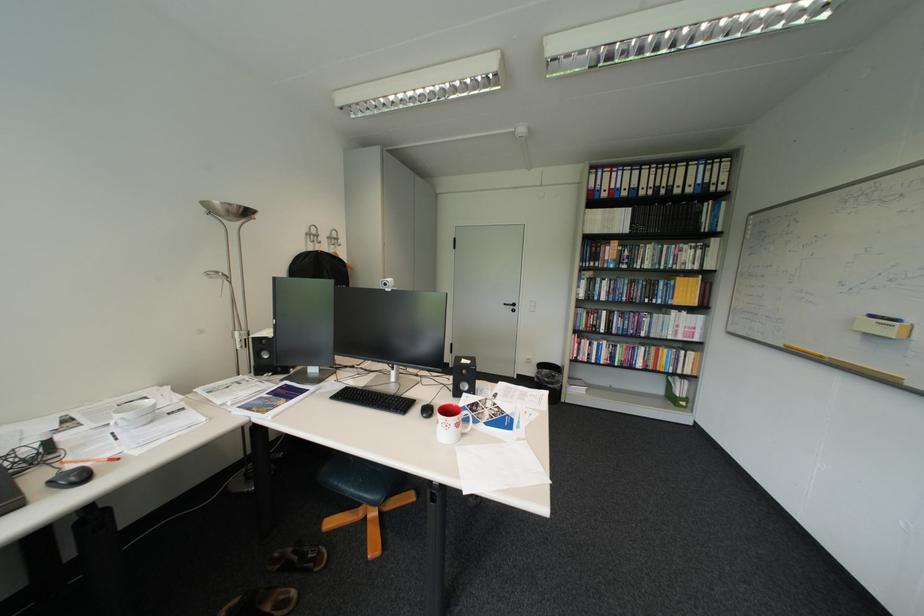
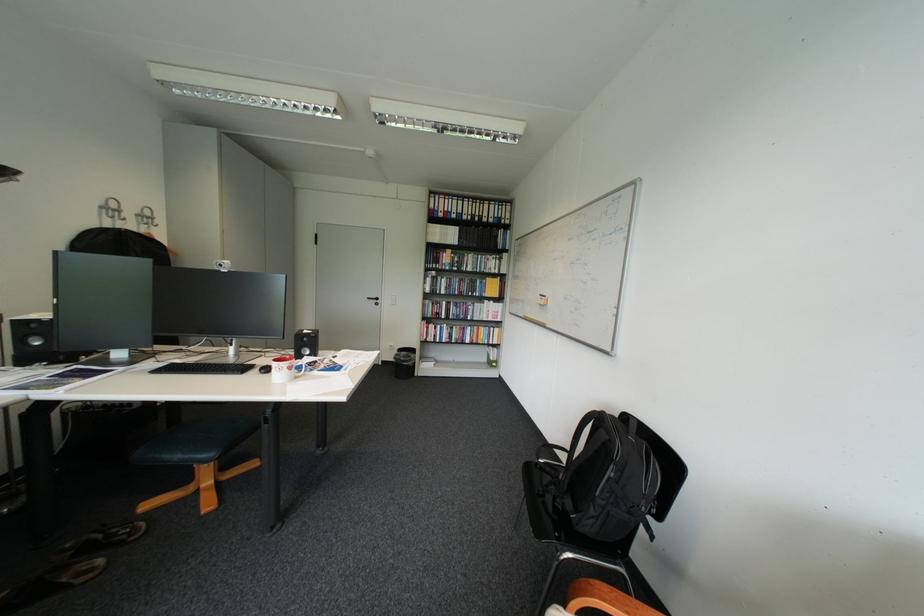
Find the pixel in the second image that matches the point at 332,243 in the first image.

(137, 220)